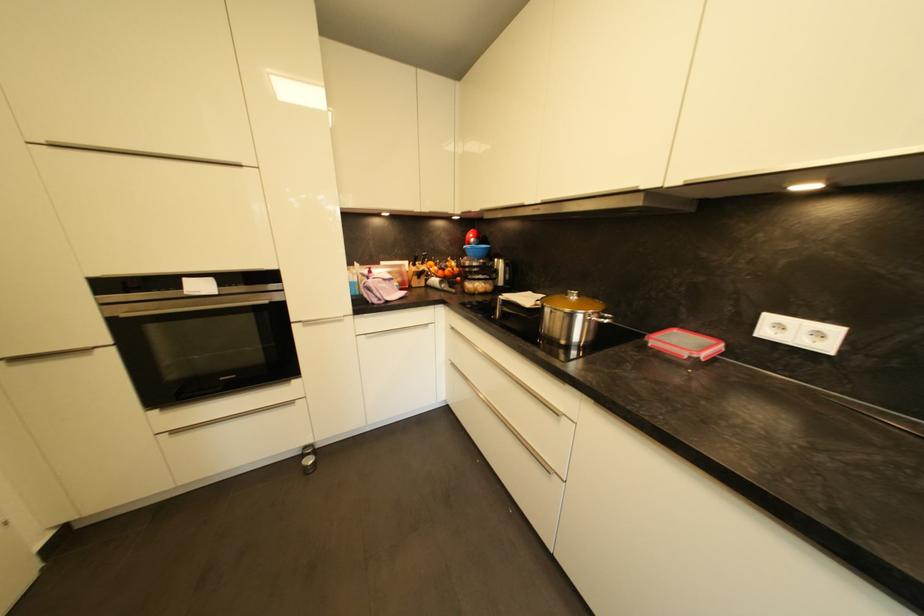
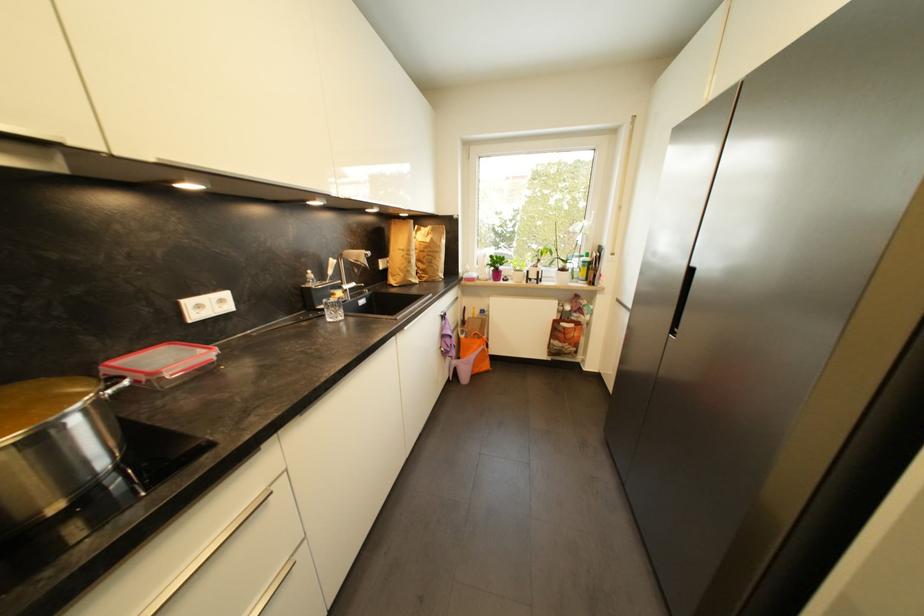
In the second image, find the point that corresponds to the point at 824,336 in the first image.

(226, 302)